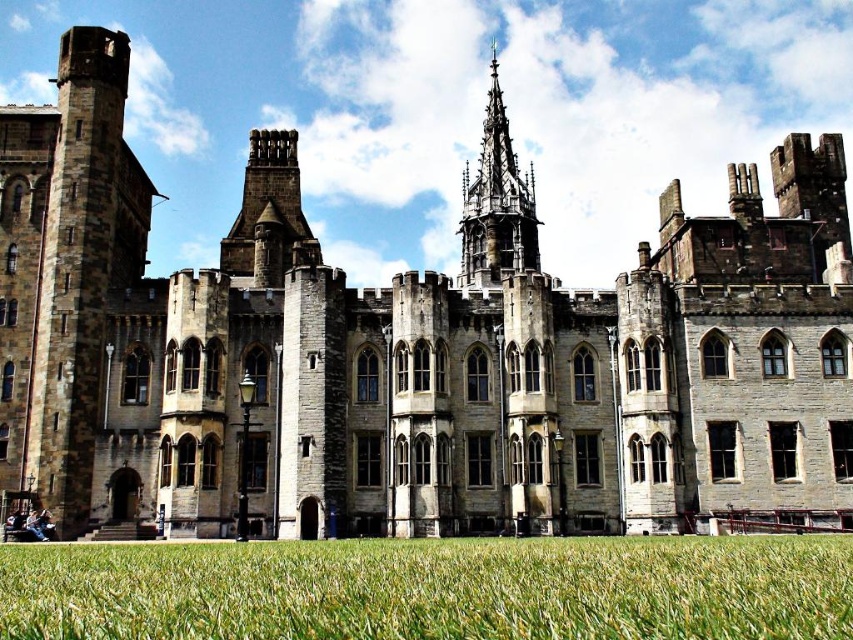
Question: Is green grass at lower center bigger than stone gothic tower at center?

Choices:
 (A) yes
 (B) no

Answer: (B)

Question: Can you confirm if green grass at lower center is thinner than stone gothic tower at center?

Choices:
 (A) no
 (B) yes

Answer: (A)

Question: Which of the following is the closest to the observer?

Choices:
 (A) (521, 228)
 (B) (288, 586)

Answer: (B)

Question: Does green grass at lower center appear under stone gothic tower at center?

Choices:
 (A) no
 (B) yes

Answer: (B)